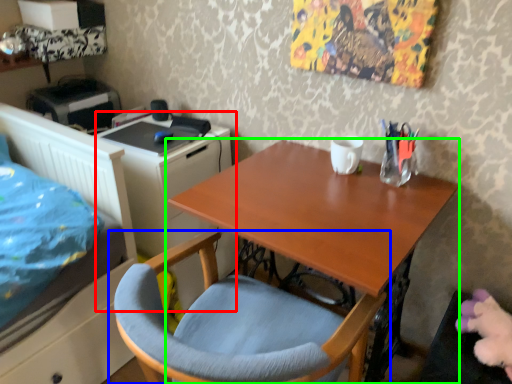
Question: Which object is the farthest from file cabinet (highlighted by a red box)? Choose among these: chair (highlighted by a blue box) or desk (highlighted by a green box).

Choices:
 (A) chair
 (B) desk

Answer: (B)